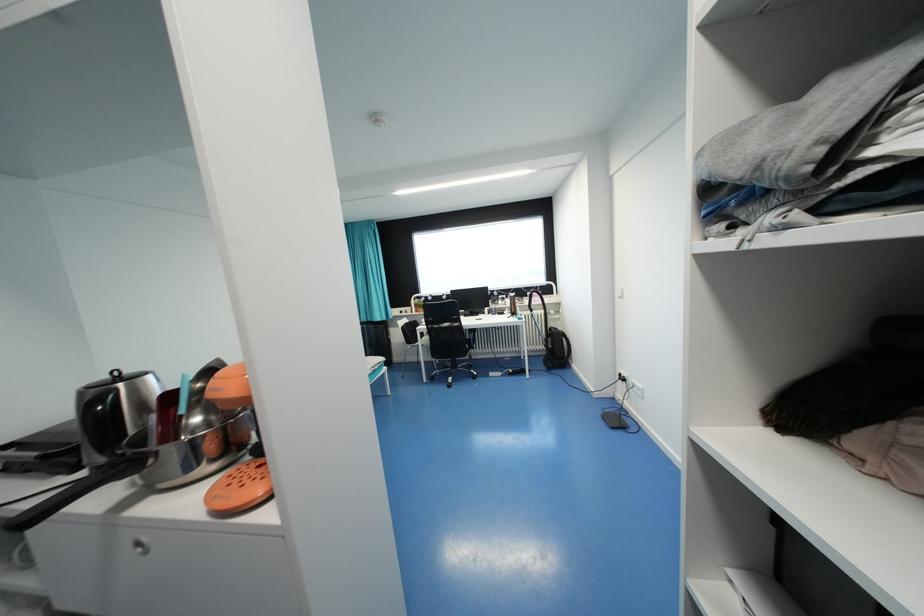
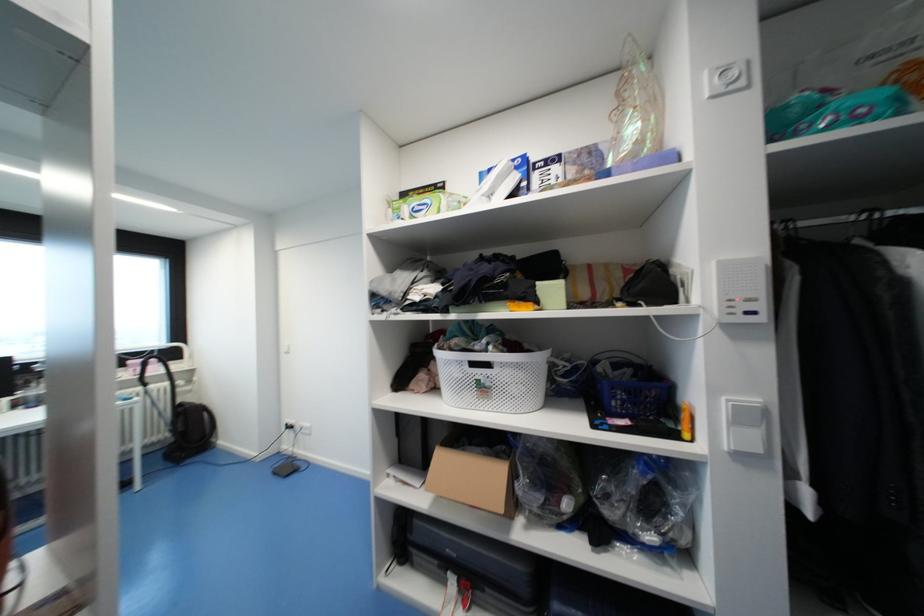
Where in the second image is the point corresponding to (x=622, y=421) from the first image?

(293, 469)